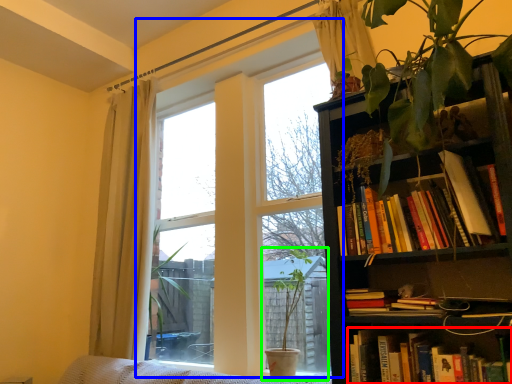
Question: Which object is positioned closest to book (highlighted by a red box)? Select from window (highlighted by a blue box) and houseplant (highlighted by a green box).

Choices:
 (A) window
 (B) houseplant

Answer: (B)